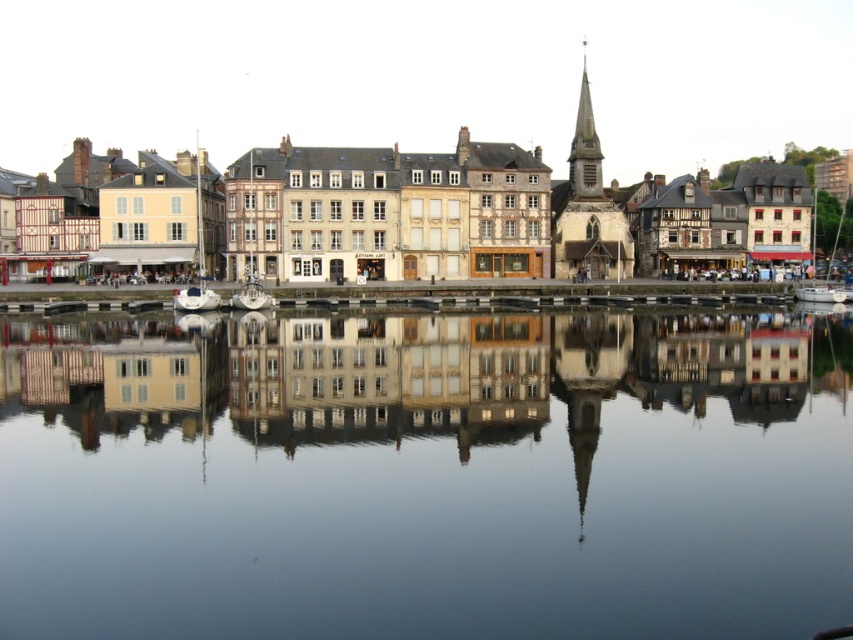
You are a tour guide leading a group along the riverside. You want to inform your group about the distance between the wooden timber buildings at center and the white wooden sailboat at center. How far apart are they?

The wooden timber buildings at center is 177.97 feet from white wooden sailboat at center.

Consider the image. You are standing on the riverside path and want to take a photo of the wooden timber buildings at center and the white matte boat at left. Which object should you focus on first if you want to capture both in a single frame without moving your camera?

You should focus on the wooden timber buildings at center first because they are above the white matte boat at left, so adjusting the camera angle to include both would require framing from the top downward.

You are an architect analyzing the riverside scene. You need to determine the spatial relationship between the smooth reflective water at center and the gray stone spire at upper right. Based on the scene, which object is positioned closer to the observer?

The smooth reflective water at center is closer to the viewer than the gray stone spire at upper right.